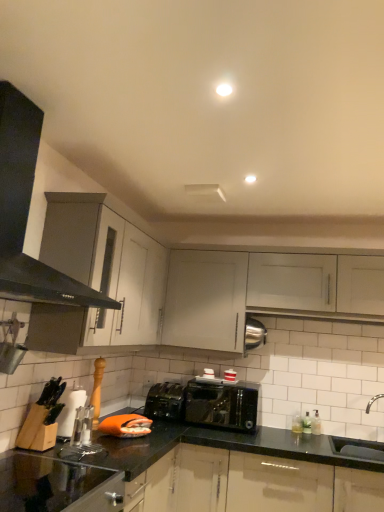
This screenshot has width=384, height=512. What do you see at coordinates (28, 212) in the screenshot?
I see `black matte exhaust hood at left` at bounding box center [28, 212].

What do you see at coordinates (165, 401) in the screenshot?
I see `matte black toaster at center` at bounding box center [165, 401].

Image resolution: width=384 pixels, height=512 pixels. Find the location of `white matte cabinet at upper center, arranged as the second cabinetry when viewed from the right`. white matte cabinet at upper center, arranged as the second cabinetry when viewed from the right is located at coordinates (205, 300).

Image resolution: width=384 pixels, height=512 pixels. What do you see at coordinates (292, 282) in the screenshot?
I see `white matte cabinet at upper center, which is counted as the first cabinetry, starting from the right` at bounding box center [292, 282].

In order to face shiny black toaster at center, should I rotate leftwards or rightwards?

Turn right approximately 4.270 degrees to face it.

You are a GUI agent. You are given a task and a screenshot of the screen. Output one action in this format:
    pyautogui.click(x=<x>, y=<y>)
    Task: Click on the black matte exhaust hood at left
    Image resolution: width=384 pixels, height=512 pixels.
    Given the screenshot: What is the action you would take?
    pyautogui.click(x=28, y=212)

Can you confirm if white matte cabinet at upper center, which appears as the first cabinetry when viewed from the left, is bigger than black matte exhaust hood at left?

No, white matte cabinet at upper center, which appears as the first cabinetry when viewed from the left, is not bigger than black matte exhaust hood at left.

Which object is positioned more to the left, white matte cabinet at upper center, arranged as the second cabinetry when viewed from the right, or black matte exhaust hood at left?

From the viewer's perspective, black matte exhaust hood at left appears more on the left side.

From the image's perspective, which is above, white matte cabinet at upper center, which appears as the first cabinetry when viewed from the left, or black matte exhaust hood at left?

black matte exhaust hood at left, from the image's perspective.

Is white matte cabinet at upper center, which is counted as the first cabinetry, starting from the right, far away from black granite countertop at lower left?

Yes.

Is white matte cabinet at upper center, the 2th cabinetry viewed from the left, wider or thinner than black granite countertop at lower left?

Considering their sizes, white matte cabinet at upper center, the 2th cabinetry viewed from the left, looks slimmer than black granite countertop at lower left.

In terms of size, does white matte cabinet at upper center, which is counted as the first cabinetry, starting from the right, appear bigger or smaller than black granite countertop at lower left?

Considering their sizes, white matte cabinet at upper center, which is counted as the first cabinetry, starting from the right, takes up less space than black granite countertop at lower left.

Who is bigger, white glossy sink at lower right, positioned as the second sink in top-to-bottom order, or white matte cabinet at upper center, which is counted as the first cabinetry, starting from the right?

With larger size is white matte cabinet at upper center, which is counted as the first cabinetry, starting from the right.

Is point (348, 442) more distant than point (301, 269)?

No.

Can you confirm if white glossy sink at lower right, arranged as the first sink when ordered from the bottom, is taller than white matte cabinet at upper center, the 2th cabinetry viewed from the left?

No, white glossy sink at lower right, arranged as the first sink when ordered from the bottom, is not taller than white matte cabinet at upper center, the 2th cabinetry viewed from the left.

From the image's perspective, count 2nd sinks downward from the white matte cabinet at upper center, the 2th cabinetry viewed from the left, and point to it. Please provide its 2D coordinates.

[(358, 448)]

Can you confirm if white glossy sink at lower right, arranged as the first sink when ordered from the bottom, is positioned to the left of matte black toaster at center?

No.

How different are the orientations of white glossy sink at lower right, positioned as the second sink in top-to-bottom order, and matte black toaster at center in degrees?

The angle between the facing direction of white glossy sink at lower right, positioned as the second sink in top-to-bottom order, and the facing direction of matte black toaster at center is 10.9 degrees.

Considering the relative sizes of white glossy sink at lower right, arranged as the first sink when ordered from the bottom, and matte black toaster at center in the image provided, is white glossy sink at lower right, arranged as the first sink when ordered from the bottom, bigger than matte black toaster at center?

Incorrect, white glossy sink at lower right, arranged as the first sink when ordered from the bottom, is not larger than matte black toaster at center.

Can you confirm if white glossy sink at lower right, arranged as the first sink when ordered from the bottom, is thinner than matte black toaster at center?

Yes.

From the image's perspective, starting from the matte black toaster at center, which sink is the 2nd one below? Please provide its 2D coordinates.

[(358, 448)]

Does matte black toaster at center have a larger size compared to white glossy sink at lower right, positioned as the second sink in top-to-bottom order?

Indeed, matte black toaster at center has a larger size compared to white glossy sink at lower right, positioned as the second sink in top-to-bottom order.

Is matte black toaster at center located outside white glossy sink at lower right, arranged as the first sink when ordered from the bottom?

Yes, matte black toaster at center is not within white glossy sink at lower right, arranged as the first sink when ordered from the bottom.

Consider the image. Is matte black toaster at center closer to camera compared to white glossy sink at lower right, arranged as the first sink when ordered from the bottom?

No, matte black toaster at center is further to the viewer.

Which is more to the left, black matte exhaust hood at left or shiny black toaster at center?

Positioned to the left is black matte exhaust hood at left.

From a real-world perspective, is black matte exhaust hood at left located beneath shiny black toaster at center?

No, from a real-world perspective, black matte exhaust hood at left is not under shiny black toaster at center.

What's the angular difference between black matte exhaust hood at left and shiny black toaster at center's facing directions?

The facing directions of black matte exhaust hood at left and shiny black toaster at center are 91.2 degrees apart.

Considering the points (13, 164) and (252, 429), which point is behind, point (13, 164) or point (252, 429)?

The point (252, 429) is more distant.

Is the surface of black matte exhaust hood at left in direct contact with white ceramic sink at lower right, which appears as the first sink when viewed from the top?

No, black matte exhaust hood at left is not in contact with white ceramic sink at lower right, which appears as the first sink when viewed from the top.

Is black matte exhaust hood at left completely or partially outside of white ceramic sink at lower right, which appears as the first sink when viewed from the top?

Yes, black matte exhaust hood at left is outside of white ceramic sink at lower right, which appears as the first sink when viewed from the top.

From the image's perspective, who appears lower, black matte exhaust hood at left or white ceramic sink at lower right, which appears as the first sink when viewed from the top?

white ceramic sink at lower right, which appears as the first sink when viewed from the top.

Identify the location of exhaust hood in front of the white matte cabinet at upper center, which appears as the first cabinetry when viewed from the left. The image size is (384, 512). (28, 212).

From the black granite countertop at lower left, count 2nd cabinetry to the right and point to it. Please provide its 2D coordinates.

[(292, 282)]

Looking at this image, which object lies further to the anchor point white glossy sink at lower right, positioned as the second sink in top-to-bottom order, matte black toaster at center or white ceramic sink at lower right, which appears as the first sink when viewed from the top?

matte black toaster at center lies further to white glossy sink at lower right, positioned as the second sink in top-to-bottom order, than the other object.

Estimate the real-world distances between objects in this image. Which object is closer to shiny black toaster at center, black granite countertop at lower left or white ceramic sink at lower right, which appears as the second sink when ordered from the bottom?

black granite countertop at lower left.

When comparing their distances from white glossy sink at lower right, positioned as the second sink in top-to-bottom order, does white matte cabinet at upper center, the 2th cabinetry viewed from the left, or black matte exhaust hood at left seem further?

Based on the image, black matte exhaust hood at left appears to be further to white glossy sink at lower right, positioned as the second sink in top-to-bottom order.

Based on their spatial positions, is white matte cabinet at upper center, which appears as the first cabinetry when viewed from the left, or white ceramic sink at lower right, which appears as the first sink when viewed from the top, closer to white glossy sink at lower right, arranged as the first sink when ordered from the bottom?

Based on the image, white ceramic sink at lower right, which appears as the first sink when viewed from the top, appears to be nearer to white glossy sink at lower right, arranged as the first sink when ordered from the bottom.

Which object lies further to the anchor point black matte exhaust hood at left, white matte cabinet at upper center, which appears as the first cabinetry when viewed from the left, or white matte cabinet at upper center, the 2th cabinetry viewed from the left?

white matte cabinet at upper center, the 2th cabinetry viewed from the left, is positioned further to the anchor black matte exhaust hood at left.

Considering their positions, is white matte cabinet at upper center, which is counted as the first cabinetry, starting from the right, positioned closer to black granite countertop at lower left than white ceramic sink at lower right, which appears as the second sink when ordered from the bottom?

white ceramic sink at lower right, which appears as the second sink when ordered from the bottom, lies closer to black granite countertop at lower left than the other object.

Considering their positions, is matte black toaster at center positioned further to white glossy sink at lower right, arranged as the first sink when ordered from the bottom, than black matte exhaust hood at left?

The object further to white glossy sink at lower right, arranged as the first sink when ordered from the bottom, is black matte exhaust hood at left.

Considering their positions, is shiny black toaster at center positioned closer to matte black toaster at center than white matte cabinet at upper center, the 2th cabinetry viewed from the left?

shiny black toaster at center lies closer to matte black toaster at center than the other object.

You are a GUI agent. You are given a task and a screenshot of the screen. Output one action in this format:
    pyautogui.click(x=<x>, y=<y>)
    Task: Click on the toaster positioned between black matte exhaust hood at left and white matte cabinet at upper center, which appears as the first cabinetry when viewed from the left, from near to far
    The height and width of the screenshot is (512, 384).
    Given the screenshot: What is the action you would take?
    pyautogui.click(x=222, y=403)

The height and width of the screenshot is (512, 384). I want to click on cabinetry that lies between white matte cabinet at upper center, the 2th cabinetry viewed from the left, and black granite countertop at lower left from top to bottom, so click(205, 300).

The width and height of the screenshot is (384, 512). Find the location of `cabinetry between white matte cabinet at upper center, the 2th cabinetry viewed from the left, and white glossy sink at lower right, arranged as the first sink when ordered from the bottom, vertically`. cabinetry between white matte cabinet at upper center, the 2th cabinetry viewed from the left, and white glossy sink at lower right, arranged as the first sink when ordered from the bottom, vertically is located at coordinates (205, 300).

Identify the location of appliance located between black granite countertop at lower left and white ceramic sink at lower right, which appears as the second sink when ordered from the bottom, in the left-right direction. This screenshot has height=512, width=384. (165, 401).